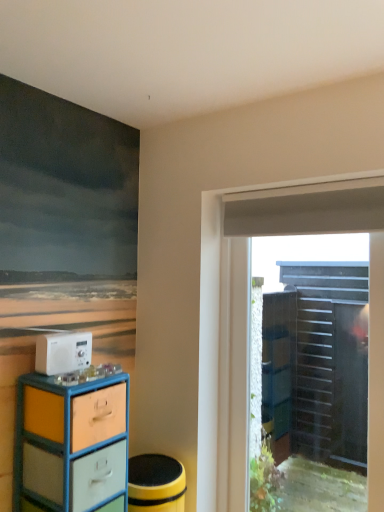
Question: From the image's perspective, does transparent plastic door at right appear higher than matte plastic chest of drawers at left?

Choices:
 (A) no
 (B) yes

Answer: (B)

Question: From a real-world perspective, is transparent plastic door at right beneath matte plastic chest of drawers at left?

Choices:
 (A) yes
 (B) no

Answer: (B)

Question: Does transparent plastic door at right have a greater height compared to matte plastic chest of drawers at left?

Choices:
 (A) yes
 (B) no

Answer: (A)

Question: Is transparent plastic door at right shorter than matte plastic chest of drawers at left?

Choices:
 (A) yes
 (B) no

Answer: (B)

Question: Is transparent plastic door at right wider than matte plastic chest of drawers at left?

Choices:
 (A) no
 (B) yes

Answer: (A)

Question: Is transparent plastic door at right at the right side of matte plastic chest of drawers at left?

Choices:
 (A) no
 (B) yes

Answer: (B)

Question: From a real-world perspective, is white plastic radio at lower left below transparent plastic door at right?

Choices:
 (A) no
 (B) yes

Answer: (A)

Question: Does white plastic radio at lower left have a greater width compared to transparent plastic door at right?

Choices:
 (A) no
 (B) yes

Answer: (A)

Question: Considering the relative sizes of white plastic radio at lower left and transparent plastic door at right in the image provided, is white plastic radio at lower left thinner than transparent plastic door at right?

Choices:
 (A) no
 (B) yes

Answer: (B)

Question: Could you tell me if white plastic radio at lower left is facing transparent plastic door at right?

Choices:
 (A) yes
 (B) no

Answer: (B)

Question: Considering the relative positions of white plastic radio at lower left and transparent plastic door at right in the image provided, is white plastic radio at lower left in front of transparent plastic door at right?

Choices:
 (A) yes
 (B) no

Answer: (A)

Question: Is white plastic radio at lower left beside transparent plastic door at right?

Choices:
 (A) no
 (B) yes

Answer: (A)

Question: From a real-world perspective, is white plastic radio at lower left on top of matte plastic chest of drawers at left?

Choices:
 (A) yes
 (B) no

Answer: (A)